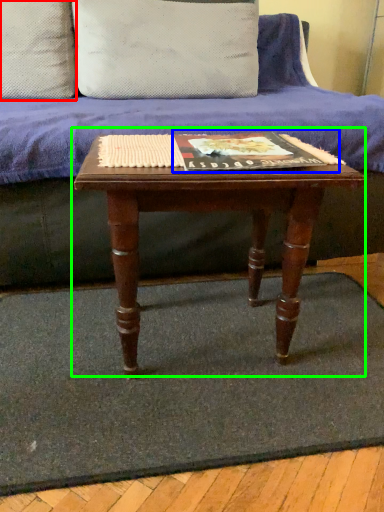
Question: Considering the real-world distances, which object is closest to pillow (highlighted by a red box)? paperback book (highlighted by a blue box) or table (highlighted by a green box).

Choices:
 (A) paperback book
 (B) table

Answer: (A)